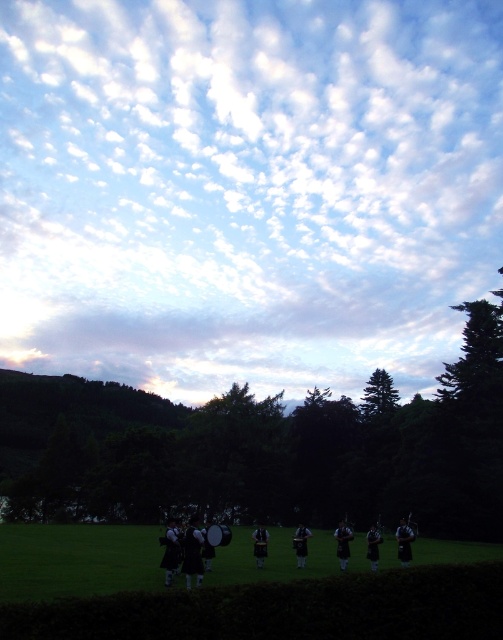
Based on the photo, you are standing in the middle of the field and looking up at the white fluffy clouds at upper center and the shiny black bagpipes at center. Which object appears closer to you?

The shiny black bagpipes at center appear closer because they are positioned closer to you than the white fluffy clouds at upper center.